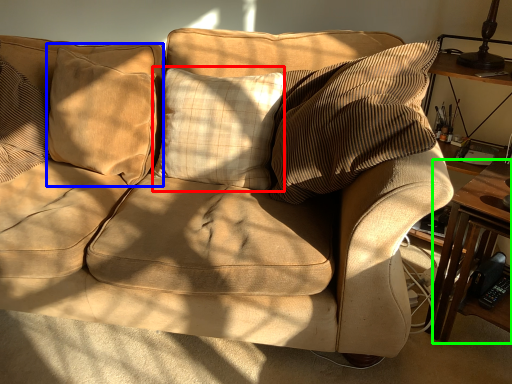
Question: Considering the real-world distances, which object is closest to pillow (highlighted by a red box)? pillow (highlighted by a blue box) or table (highlighted by a green box).

Choices:
 (A) pillow
 (B) table

Answer: (A)